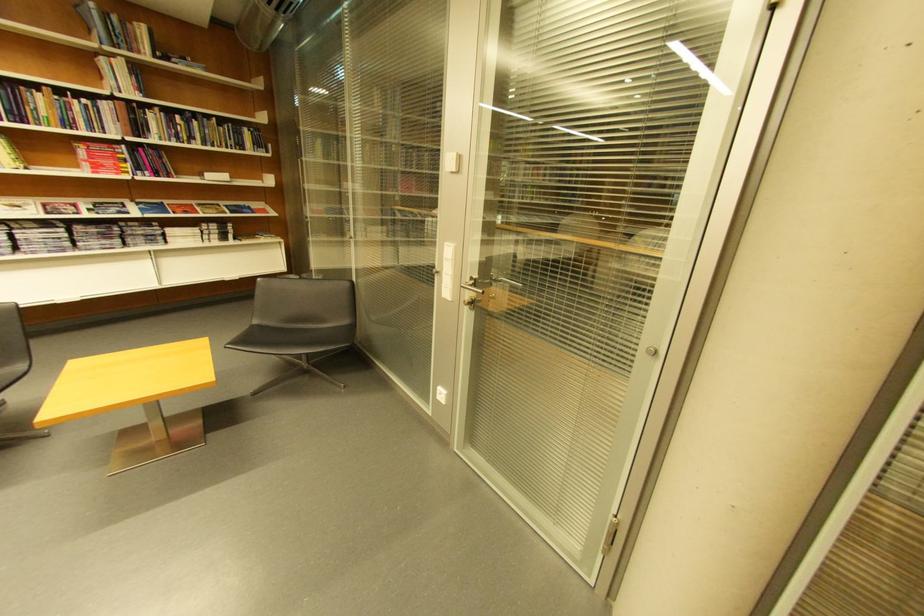
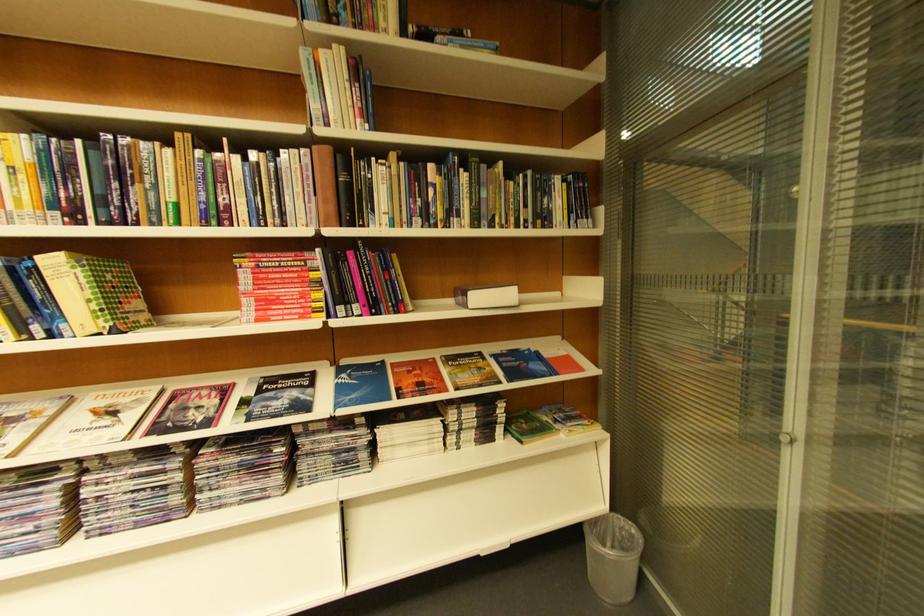
Where in the second image is the point corresponding to point (139, 124) from the first image?

(342, 196)